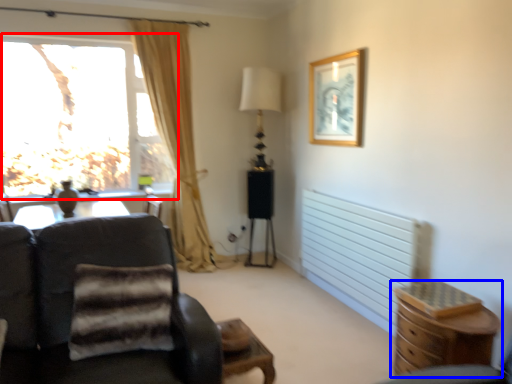
Question: Which object appears closest to the camera in this image, window (highlighted by a red box) or chest of drawers (highlighted by a blue box)?

Choices:
 (A) window
 (B) chest of drawers

Answer: (B)